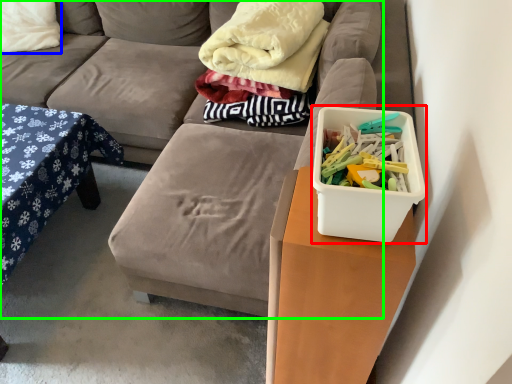
Question: Which object is positioned closest to storage box (highlighted by a red box)? Select from pillow (highlighted by a blue box) and studio couch (highlighted by a green box).

Choices:
 (A) pillow
 (B) studio couch

Answer: (B)